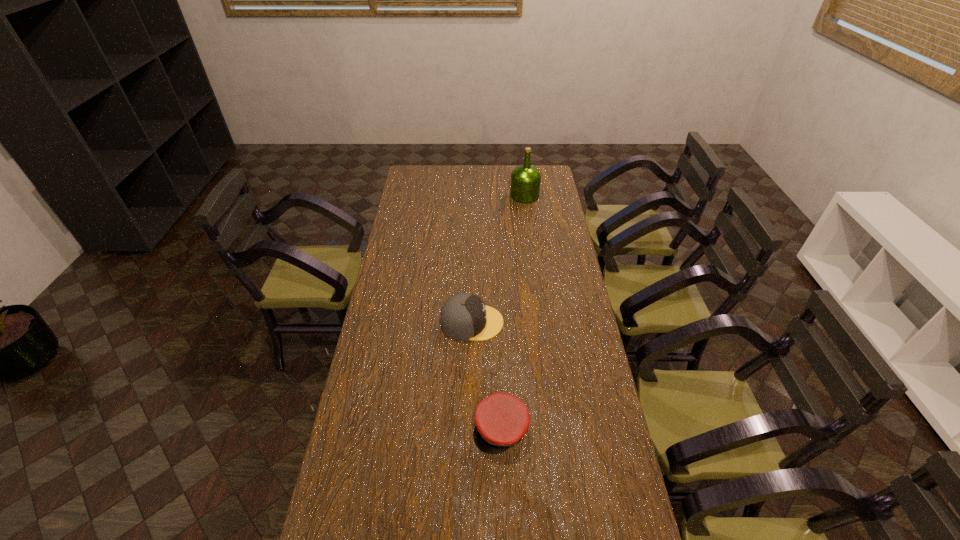
The width and height of the screenshot is (960, 540). In the image, there is a desktop. What are the coordinates of `vacant space at the far edge` in the screenshot? It's located at (480, 183).

Find the location of `vacant space at the left edge`. vacant space at the left edge is located at coordinates (412, 299).

The height and width of the screenshot is (540, 960). In the image, there is a desktop. Find the location of `blank space at the right edge`. blank space at the right edge is located at coordinates (562, 259).

Locate an element on the screen. blank region between the tallest object and the shortest object is located at coordinates (513, 312).

What are the coordinates of `free spot between the taller cap and the shorter cap` in the screenshot? It's located at (487, 375).

Where is `free space between the rightmost object and the taller cap`? free space between the rightmost object and the taller cap is located at coordinates (498, 259).

At what (x,y) coordinates should I click in order to perform the action: click on free spot between the shortest object and the second farthest object. Please return your answer as a coordinate pair (x, y). This screenshot has width=960, height=540. Looking at the image, I should click on (487, 375).

Locate an element on the screen. free space between the nearer cap and the farther cap is located at coordinates tap(487, 375).

Identify the location of free area in between the tallest object and the shorter cap. Image resolution: width=960 pixels, height=540 pixels. (513, 312).

Locate an element on the screen. The image size is (960, 540). the closest object relative to the olive oil is located at coordinates (464, 316).